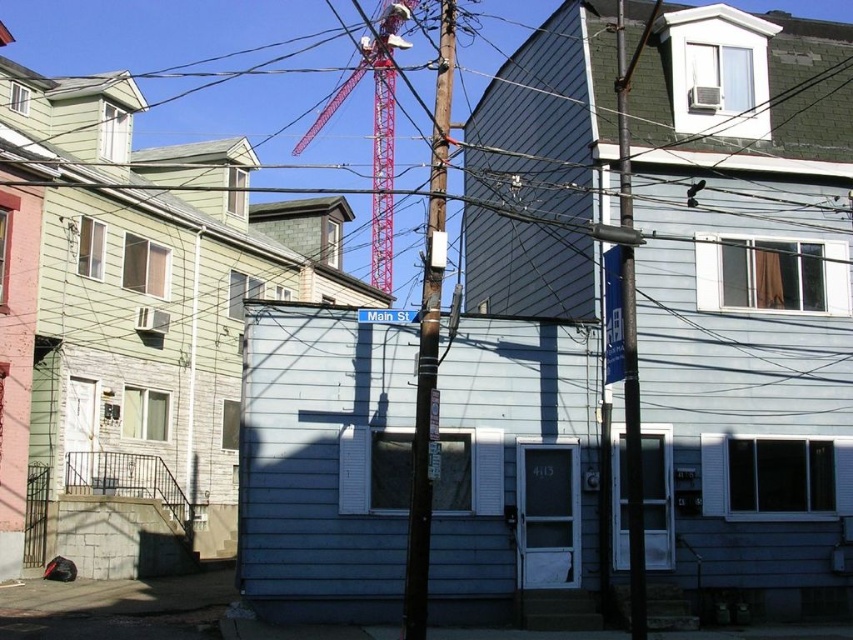
Question: Which of the following is the closest to the observer?

Choices:
 (A) (619, 102)
 (B) (409, 573)

Answer: (B)

Question: Does brown wooden telegraph pole at center lie behind smooth wood telegraph pole at center?

Choices:
 (A) yes
 (B) no

Answer: (B)

Question: Which object appears closest to the camera in this image?

Choices:
 (A) smooth wood telegraph pole at center
 (B) brown wooden telegraph pole at center

Answer: (B)

Question: Among these points, which one is nearest to the camera?

Choices:
 (A) (387, 291)
 (B) (422, 324)

Answer: (B)

Question: Is smooth wood telegraph pole at center to the left of red metal crane at upper center from the viewer's perspective?

Choices:
 (A) no
 (B) yes

Answer: (A)

Question: Does smooth wood telegraph pole at center have a smaller size compared to red metal crane at upper center?

Choices:
 (A) yes
 (B) no

Answer: (A)